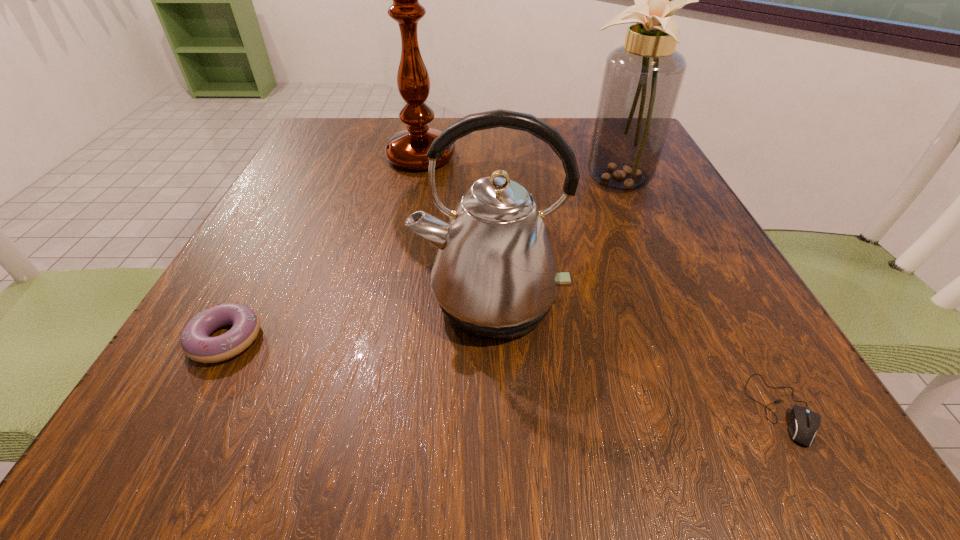
You are a GUI agent. You are given a task and a screenshot of the screen. Output one action in this format:
    pyautogui.click(x=<x>, y=<y>)
    Task: Click on the vacant space in between the kettle and the fourth shortest object
    
    Given the screenshot: What is the action you would take?
    (553, 238)

Locate an element on the screen. vacant space in between the tallest object and the second tallest object is located at coordinates (518, 166).

At what (x,y) coordinates should I click in order to perform the action: click on free space that is in between the nearest object and the third tallest object. Please return your answer as a coordinate pair (x, y). Looking at the image, I should click on (636, 355).

Identify the location of free space that is in between the doughnut and the tallest object. The width and height of the screenshot is (960, 540). (324, 248).

I want to click on free point between the table lamp and the second tallest object, so click(x=518, y=166).

Locate an element on the screen. This screenshot has width=960, height=540. object that is the third closest one to the nearest object is located at coordinates (407, 149).

Select which object is the second closest to the third shortest object. Please provide its 2D coordinates. Your answer should be formatted as a tuple, i.e. [(x, y)], where the tuple contains the x and y coordinates of a point satisfying the conditions above.

[(407, 149)]

Where is `free location that satisfies the following two spatial constraints: 1. from the spout of the kettle; 2. on the left side of the computer mouse`? This screenshot has height=540, width=960. free location that satisfies the following two spatial constraints: 1. from the spout of the kettle; 2. on the left side of the computer mouse is located at coordinates (493, 409).

You are a GUI agent. You are given a task and a screenshot of the screen. Output one action in this format:
    pyautogui.click(x=<x>, y=<y>)
    Task: Click on the vacant region that satisfies the following two spatial constraints: 1. on the back side of the tallest object; 2. on the right side of the leftmost object
    The image size is (960, 540).
    Given the screenshot: What is the action you would take?
    pyautogui.click(x=324, y=157)

Find the location of a particular element. This screenshot has width=960, height=540. vacant space that satisfies the following two spatial constraints: 1. on the front side of the shortest object; 2. on the right side of the tallest object is located at coordinates (370, 409).